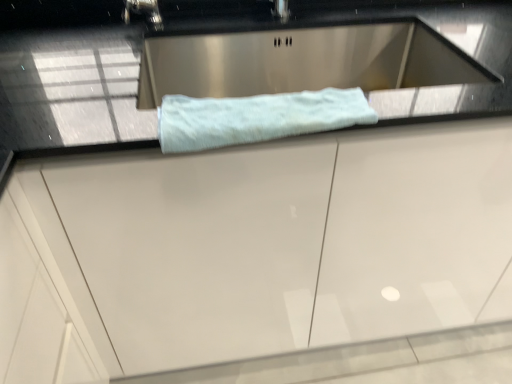
Image resolution: width=512 pixels, height=384 pixels. What do you see at coordinates (256, 118) in the screenshot?
I see `light blue plush towel at center` at bounding box center [256, 118].

I want to click on light blue plush towel at center, so click(x=256, y=118).

What is the approximate height of white glossy cabinet at center?

white glossy cabinet at center is 90.79 centimeters in height.

What are the coordinates of `white glossy cabinet at center` in the screenshot? It's located at (254, 253).

Image resolution: width=512 pixels, height=384 pixels. What do you see at coordinates (254, 253) in the screenshot?
I see `white glossy cabinet at center` at bounding box center [254, 253].

You are a GUI agent. You are given a task and a screenshot of the screen. Output one action in this format:
    pyautogui.click(x=<x>, y=<y>)
    Task: Click on the light blue plush towel at center
    This screenshot has height=384, width=512.
    Given the screenshot: What is the action you would take?
    pyautogui.click(x=256, y=118)

Which object is positioned more to the right, light blue plush towel at center or white glossy cabinet at center?

white glossy cabinet at center.

Is light blue plush towel at center in front of or behind white glossy cabinet at center in the image?

Visually, light blue plush towel at center is located behind white glossy cabinet at center.

Which point is more forward, (305, 132) or (85, 187)?

The point (85, 187) is closer to the camera.

From the image's perspective, which is above, light blue plush towel at center or white glossy cabinet at center?

light blue plush towel at center is shown above in the image.

From a real-world perspective, is light blue plush towel at center physically located above or below white glossy cabinet at center?

In terms of real-world spatial position, light blue plush towel at center is above white glossy cabinet at center.

Which object is wider, light blue plush towel at center or white glossy cabinet at center?

Wider between the two is white glossy cabinet at center.

Considering the relative sizes of light blue plush towel at center and white glossy cabinet at center in the image provided, is light blue plush towel at center taller than white glossy cabinet at center?

No, light blue plush towel at center is not taller than white glossy cabinet at center.

Is light blue plush towel at center bigger or smaller than white glossy cabinet at center?

In the image, light blue plush towel at center appears to be smaller than white glossy cabinet at center.

Consider the image. Do you think light blue plush towel at center is within white glossy cabinet at center, or outside of it?

The correct answer is: inside.

Are light blue plush towel at center and white glossy cabinet at center making contact?

No, light blue plush towel at center is not in contact with white glossy cabinet at center.

Is light blue plush towel at center oriented towards white glossy cabinet at center?

Yes, light blue plush towel at center is oriented towards white glossy cabinet at center.

Can you tell me how much light blue plush towel at center and white glossy cabinet at center differ in facing direction?

light blue plush towel at center and white glossy cabinet at center are facing 1.29 degrees away from each other.

Where is `cabinetry in front of the light blue plush towel at center`? The height and width of the screenshot is (384, 512). cabinetry in front of the light blue plush towel at center is located at coordinates (254, 253).

Can you confirm if white glossy cabinet at center is positioned to the left of light blue plush towel at center?

No, white glossy cabinet at center is not to the left of light blue plush towel at center.

Is white glossy cabinet at center in front of or behind light blue plush towel at center in the image?

Visually, white glossy cabinet at center is located in front of light blue plush towel at center.

Does point (79, 205) come closer to viewer compared to point (170, 118)?

No, (79, 205) is further to viewer.

From the image's perspective, between white glossy cabinet at center and light blue plush towel at center, who is located below?

white glossy cabinet at center appears lower in the image.

From a real-world perspective, who is located lower, white glossy cabinet at center or light blue plush towel at center?

In real-world perspective, white glossy cabinet at center is lower.

Which object is thinner, white glossy cabinet at center or light blue plush towel at center?

light blue plush towel at center is thinner.

Which of these two, white glossy cabinet at center or light blue plush towel at center, stands taller?

With more height is white glossy cabinet at center.

Considering the sizes of white glossy cabinet at center and light blue plush towel at center in the image, is white glossy cabinet at center bigger or smaller than light blue plush towel at center?

In the image, white glossy cabinet at center appears to be larger than light blue plush towel at center.

Would you say white glossy cabinet at center is inside or outside light blue plush towel at center?

white glossy cabinet at center exists outside the volume of light blue plush towel at center.

Is white glossy cabinet at center positioned far away from light blue plush towel at center?

No.

Is white glossy cabinet at center oriented away from light blue plush towel at center?

No.

Can you tell me how much white glossy cabinet at center and light blue plush towel at center differ in facing direction?

1.29 degrees.

Where is `cabinetry below the light blue plush towel at center (from a real-world perspective)`? This screenshot has height=384, width=512. cabinetry below the light blue plush towel at center (from a real-world perspective) is located at coordinates (254, 253).

This screenshot has height=384, width=512. What are the coordinates of `cabinetry on the right of light blue plush towel at center` in the screenshot? It's located at (254, 253).

I want to click on bath towel behind the white glossy cabinet at center, so click(x=256, y=118).